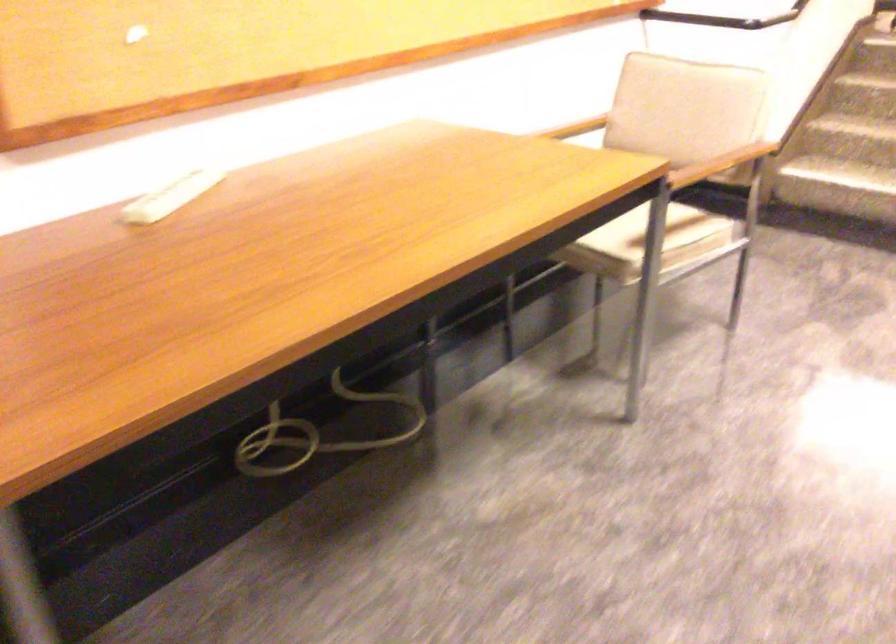
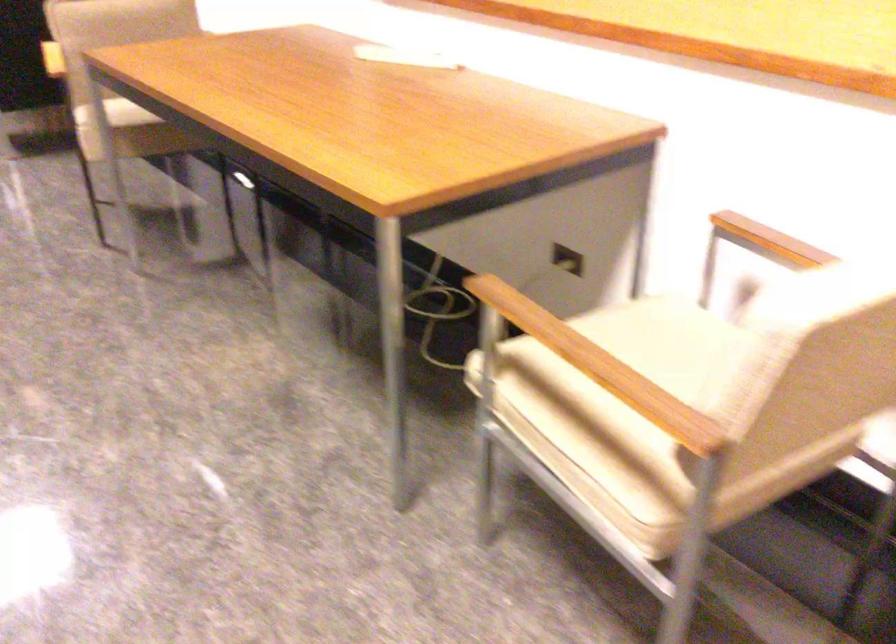
Where in the second image is the point corresponding to (x=747, y=158) from the first image?

(619, 399)